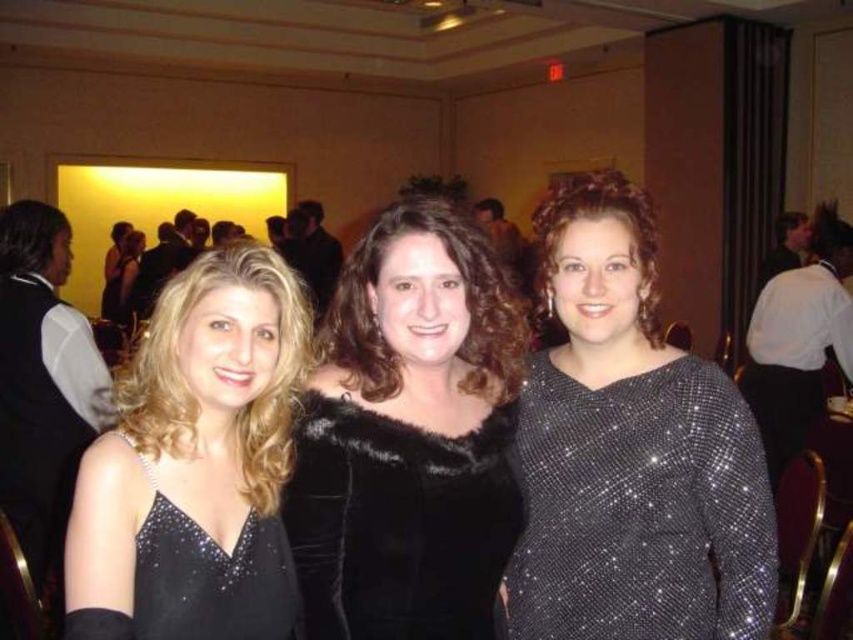
Is sparkly silver dress at center positioned at the back of sparkly black dress at left?

Yes.

Which is more to the left, sparkly silver dress at center or sparkly black dress at left?

sparkly black dress at left

Is point (601, 296) farther from viewer compared to point (74, 611)?

Yes, it is behind point (74, 611).

At what (x,y) coordinates should I click in order to perform the action: click on sparkly silver dress at center. Please return your answer as a coordinate pair (x, y). Looking at the image, I should click on (631, 451).

Is velvet black fur coat at center shorter than satin black dress at left?

No.

Who is more distant from viewer, (506, 515) or (163, 484)?

The point (506, 515) is behind.

The height and width of the screenshot is (640, 853). Find the location of `velvet black fur coat at center`. velvet black fur coat at center is located at coordinates (409, 436).

Does sparkly silver dress at center have a larger size compared to satin black dress at left?

Correct, sparkly silver dress at center is larger in size than satin black dress at left.

Between point (682, 484) and point (115, 618), which one is positioned behind?

The point (682, 484) is more distant.

Where is `sparkly silver dress at center`? The width and height of the screenshot is (853, 640). sparkly silver dress at center is located at coordinates (631, 451).